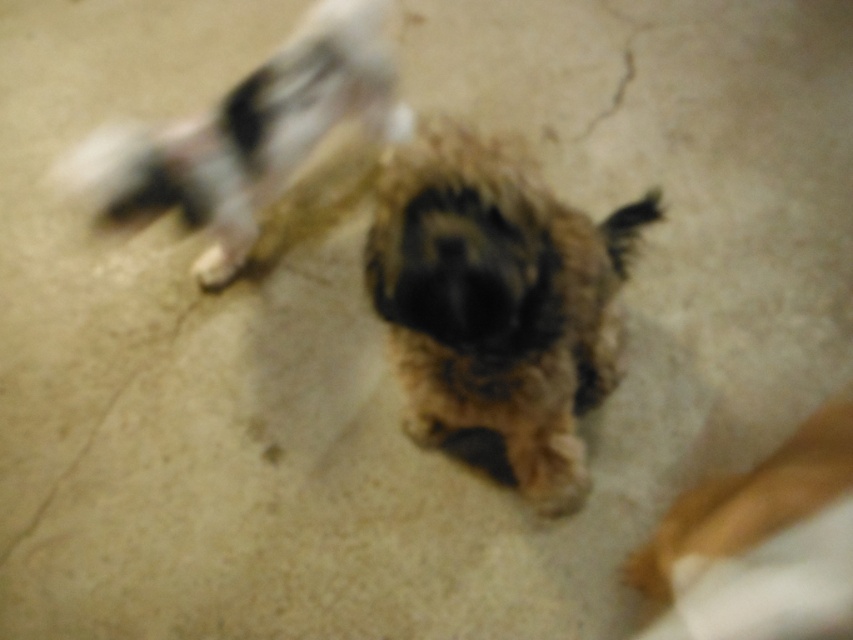
Question: Can you confirm if fluffy brown dog at upper left is thinner than brown fuzzy dog at center?

Choices:
 (A) no
 (B) yes

Answer: (A)

Question: Based on their relative distances, which object is nearer to the fuzzy brown paw at center?

Choices:
 (A) fluffy brown dog at upper left
 (B) brown fuzzy dog at center
 (C) fuzzy brown dog at center

Answer: (A)

Question: Does fuzzy brown dog at center appear on the left side of fluffy brown dog at upper left?

Choices:
 (A) yes
 (B) no

Answer: (B)

Question: Among these objects, which one is farthest from the camera?

Choices:
 (A) brown fuzzy dog at center
 (B) fluffy brown dog at upper left

Answer: (B)

Question: Does brown fuzzy dog at center have a larger size compared to fuzzy brown paw at center?

Choices:
 (A) yes
 (B) no

Answer: (A)

Question: Estimate the real-world distances between objects in this image. Which object is farther from the brown fuzzy dog at center?

Choices:
 (A) fluffy brown dog at upper left
 (B) fuzzy brown dog at center

Answer: (A)